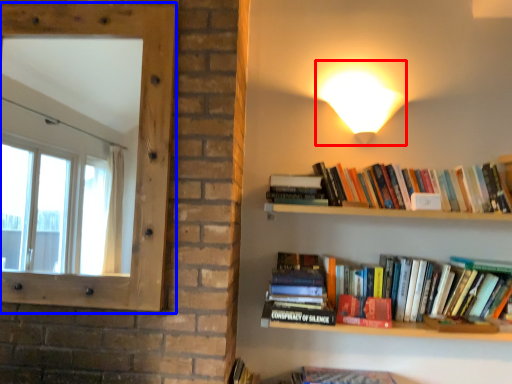
Question: Which object appears closest to the camera in this image, light (highlighted by a red box) or window screen (highlighted by a blue box)?

Choices:
 (A) light
 (B) window screen

Answer: (B)